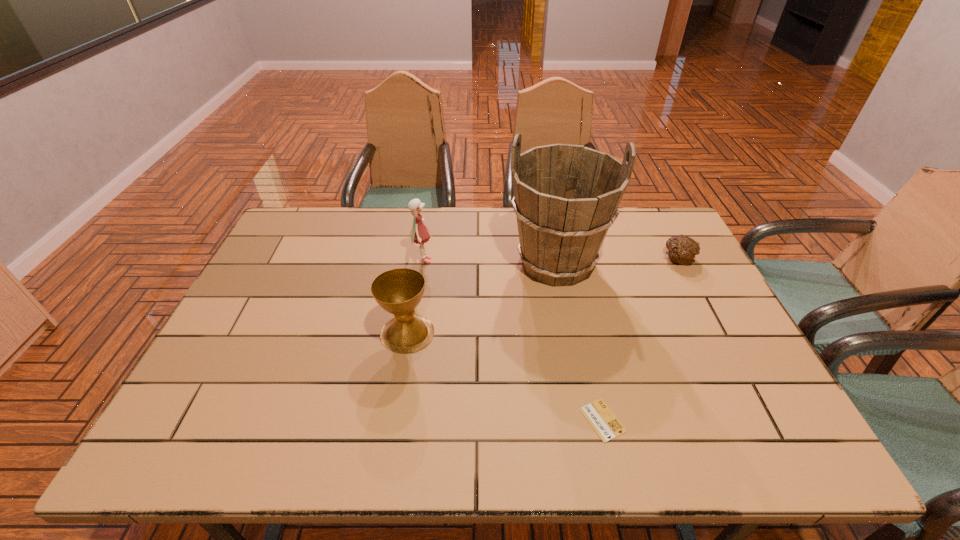
Identify the location of bucket. (566, 197).

At what (x,y) coordinates should I click in order to perform the action: click on the fourth shortest object. Please return your answer as a coordinate pair (x, y). The image size is (960, 540). Looking at the image, I should click on (419, 234).

Where is `the second nearest object`? the second nearest object is located at coordinates (398, 291).

What are the coordinates of `chalice` in the screenshot? It's located at (398, 291).

Where is `the rightmost object`? the rightmost object is located at coordinates (681, 249).

Identify the location of muffin. Image resolution: width=960 pixels, height=540 pixels. (681, 249).

The height and width of the screenshot is (540, 960). In order to click on identity card in this screenshot , I will do `click(606, 425)`.

Where is `the nearest object`? The image size is (960, 540). the nearest object is located at coordinates (606, 425).

This screenshot has height=540, width=960. Find the location of `vacant space located 0.110m on the front of the tallest object`. vacant space located 0.110m on the front of the tallest object is located at coordinates (568, 327).

The height and width of the screenshot is (540, 960). Identify the location of free space located on the front-facing side of the fourth shortest object. (488, 260).